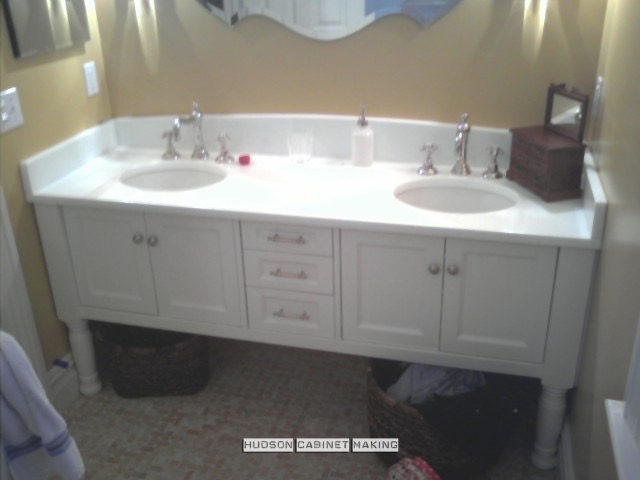
The image size is (640, 480). Identify the location of hamper. (411, 422).